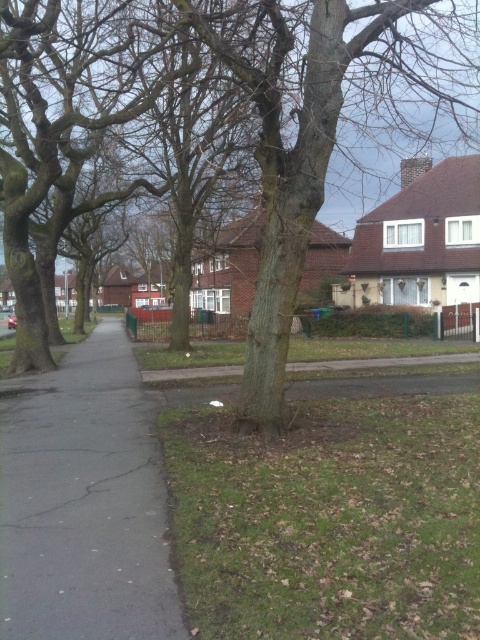
You are standing at the point with coordinates 0.2, 0.7. Which direction should you move to get closer to the brown rough tree at center?

Since the brown rough tree at center is located at point (326, 120) and you are at (336, 128), you should move slightly downward and to the right to get closer to the tree.

You are a city planner evaluating the space between the brown rough tree at center and the black asphalt pavement at left. If you want to install a small bench that requires 2 meters of space, is there enough room based on their sizes?

The brown rough tree at center is larger in size than the black asphalt pavement at left. Since the tree is bigger, it might occupy more space, leaving less room for the bench. However, without exact measurements of the distance between them, it is unclear if the 2 meters required for the bench is available. The size comparison alone does not provide sufficient information about the available space between them.

You are standing at the point marked as point [326,120] on the residential street scene. What object are you touching?

The point [326,120] is on the brown rough tree at center, so you are touching the brown rough tree at center.